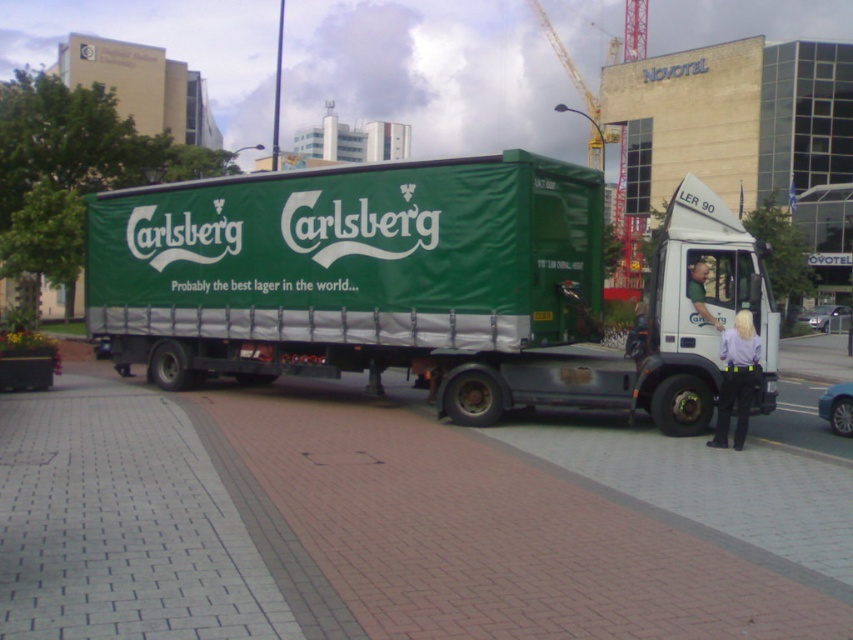
Does green fabric truck at center come in front of light brown leather jacket at center?

Yes, it is in front of light brown leather jacket at center.

Does green fabric truck at center have a lesser height compared to light brown leather jacket at center?

No, green fabric truck at center is not shorter than light brown leather jacket at center.

Who is more forward, [193,323] or [697,301]?

Point [697,301]

At what (x,y) coordinates should I click in order to perform the action: click on green fabric truck at center. Please return your answer as a coordinate pair (x, y). Looking at the image, I should click on (421, 285).

Is brick pavement at center wider than green fabric truck at center?

No, brick pavement at center is not wider than green fabric truck at center.

Which is below, brick pavement at center or green fabric truck at center?

brick pavement at center

Describe the element at coordinates (398, 522) in the screenshot. This screenshot has width=853, height=640. I see `brick pavement at center` at that location.

Where is `brick pavement at center`? This screenshot has width=853, height=640. brick pavement at center is located at coordinates (398, 522).

Does brick pavement at center have a lesser width compared to light brown leather jacket at center?

Incorrect, brick pavement at center's width is not less than light brown leather jacket at center's.

Where is `brick pavement at center`? brick pavement at center is located at coordinates (398, 522).

Is point (321, 426) more distant than point (718, 321)?

Yes, it is.

Image resolution: width=853 pixels, height=640 pixels. Find the location of `brick pavement at center`. brick pavement at center is located at coordinates (398, 522).